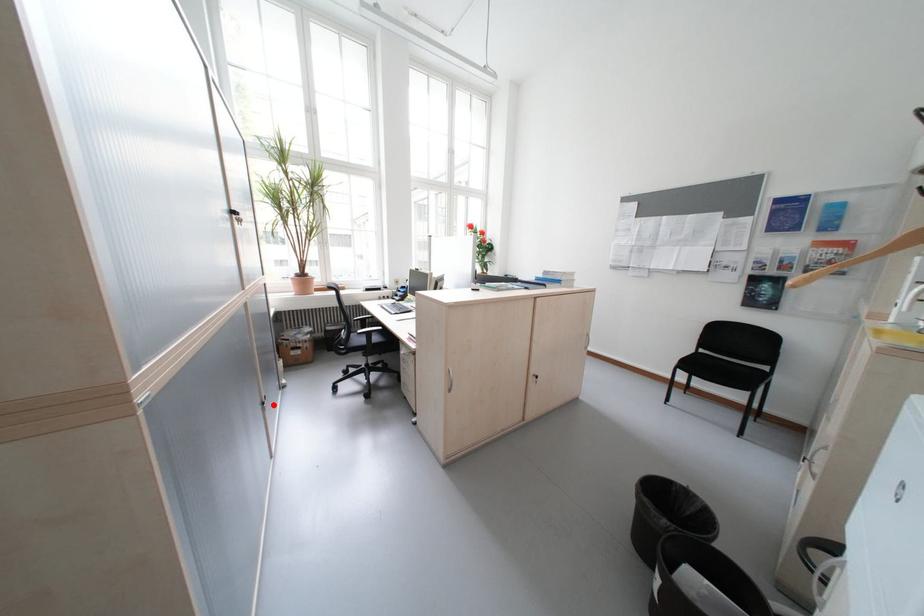
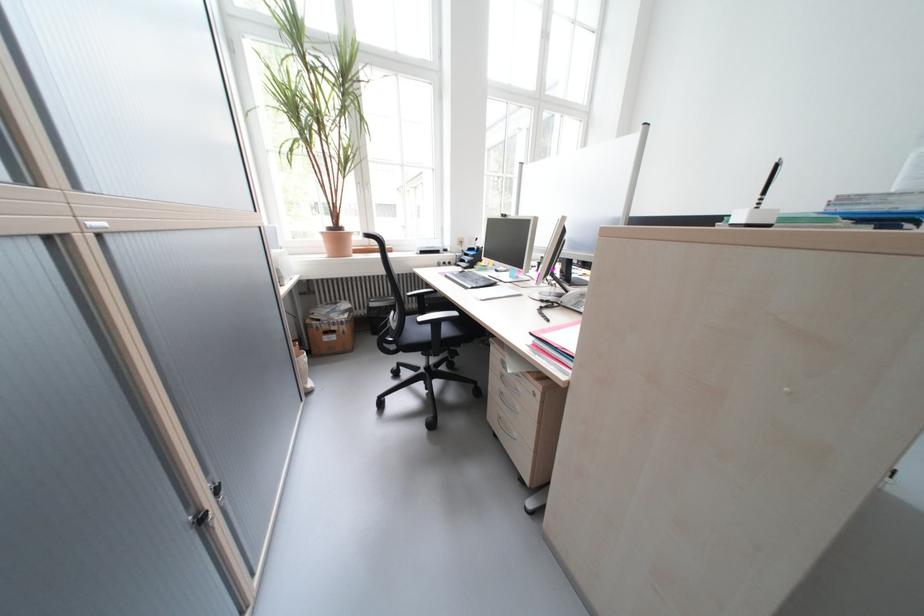
Question: I am providing you with two images of the same scene from different viewpoints. Image1 has a red point marked. In image2, the corresponding 3D location appears at what relative position? Reply with the corresponding letter.

Choices:
 (A) Closer
 (B) Farther

Answer: (B)